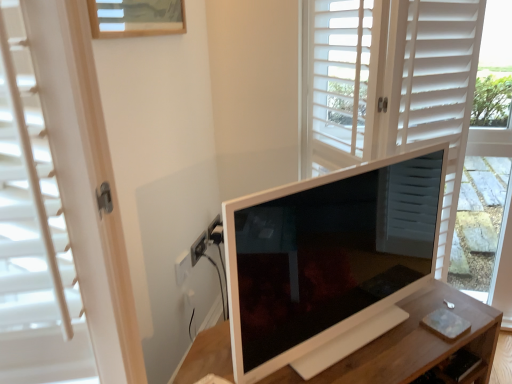
Find the location of a particular element. This screenshot has width=512, height=384. vacant space to the right of white glossy monitor at center is located at coordinates click(x=422, y=327).